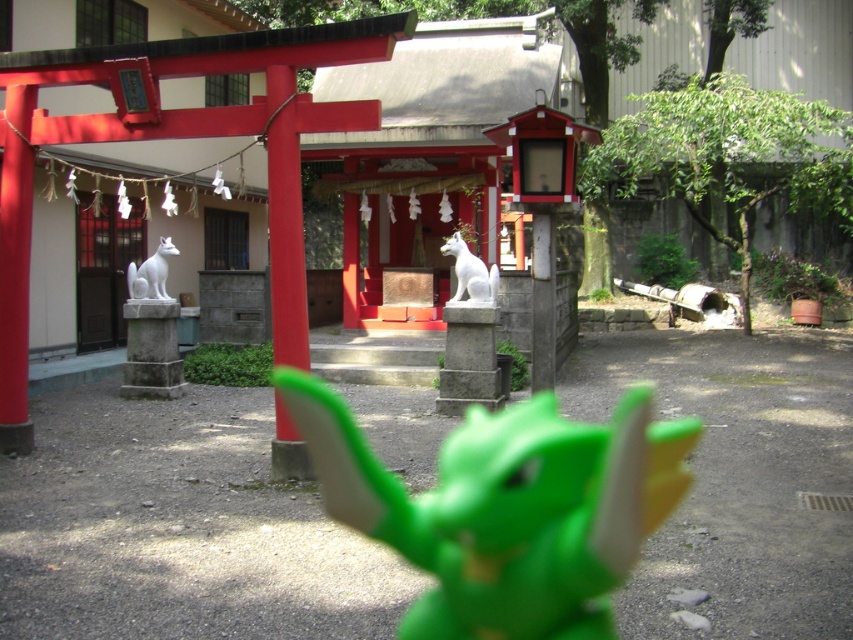
You are standing at the camera position and want to pick up the green plastic toy at center. Is the toy within your immediate reach without moving your feet?

The green plastic toy at center is 4.04 meters away from the camera, so it is out of immediate reach without moving your feet.

You are a visitor at the shrine and want to place a small offering at the base of the statue. Since the statue is under the fox, will you have to walk around the white marble fox at center to reach the white glossy statue at center?

The white glossy statue at center is positioned under the white marble fox at center, so you will need to walk around the white marble fox at center to access the base of the white glossy statue at center.

Based on the photo, you are standing at the entrance of the shrine and want to place a small offering at the base of the white glossy statue at center. According to the shrine layout, where should you walk to reach the statue?

The white glossy statue at center is located at point coordinates (471, 273), so you should walk towards the center area of the shrine to reach it.